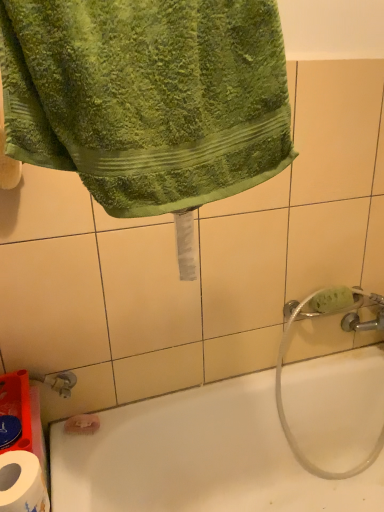
Question: Should I look upward or downward to see green terry cloth towel at upper left?

Choices:
 (A) down
 (B) up

Answer: (B)

Question: From the image's perspective, is white paper at lower left located above white glossy bathtub at lower left?

Choices:
 (A) no
 (B) yes

Answer: (B)

Question: Does white paper at lower left have a larger size compared to white glossy bathtub at lower left?

Choices:
 (A) yes
 (B) no

Answer: (B)

Question: Are white paper at lower left and white glossy bathtub at lower left located far from each other?

Choices:
 (A) no
 (B) yes

Answer: (A)

Question: Are white paper at lower left and white glossy bathtub at lower left making contact?

Choices:
 (A) no
 (B) yes

Answer: (A)

Question: Is white paper at lower left positioned behind white glossy bathtub at lower left?

Choices:
 (A) yes
 (B) no

Answer: (B)

Question: Can you confirm if white paper at lower left is wider than white glossy bathtub at lower left?

Choices:
 (A) no
 (B) yes

Answer: (A)

Question: Would you consider white paper at lower left to be distant from green sponge at right?

Choices:
 (A) yes
 (B) no

Answer: (B)

Question: Is white paper at lower left to the right of green sponge at right from the viewer's perspective?

Choices:
 (A) no
 (B) yes

Answer: (A)

Question: From a real-world perspective, is white paper at lower left on top of green sponge at right?

Choices:
 (A) no
 (B) yes

Answer: (A)

Question: From the image's perspective, is white paper at lower left under green sponge at right?

Choices:
 (A) yes
 (B) no

Answer: (A)

Question: Considering the relative sizes of white paper at lower left and green sponge at right in the image provided, is white paper at lower left smaller than green sponge at right?

Choices:
 (A) yes
 (B) no

Answer: (B)

Question: Considering the relative sizes of white paper at lower left and green sponge at right in the image provided, is white paper at lower left bigger than green sponge at right?

Choices:
 (A) no
 (B) yes

Answer: (B)

Question: Can you confirm if white glossy bathtub at lower left is thinner than green sponge at right?

Choices:
 (A) yes
 (B) no

Answer: (B)